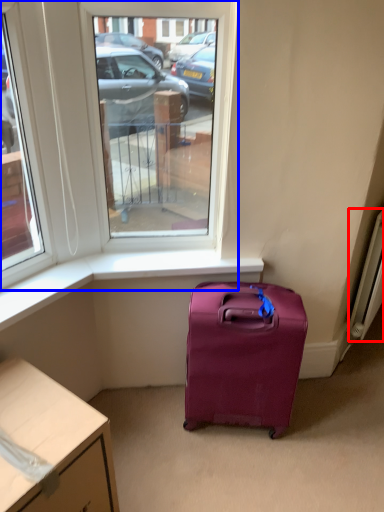
Question: Which point is closer to the camera, radiator (highlighted by a red box) or window (highlighted by a blue box)?

Choices:
 (A) radiator
 (B) window

Answer: (B)